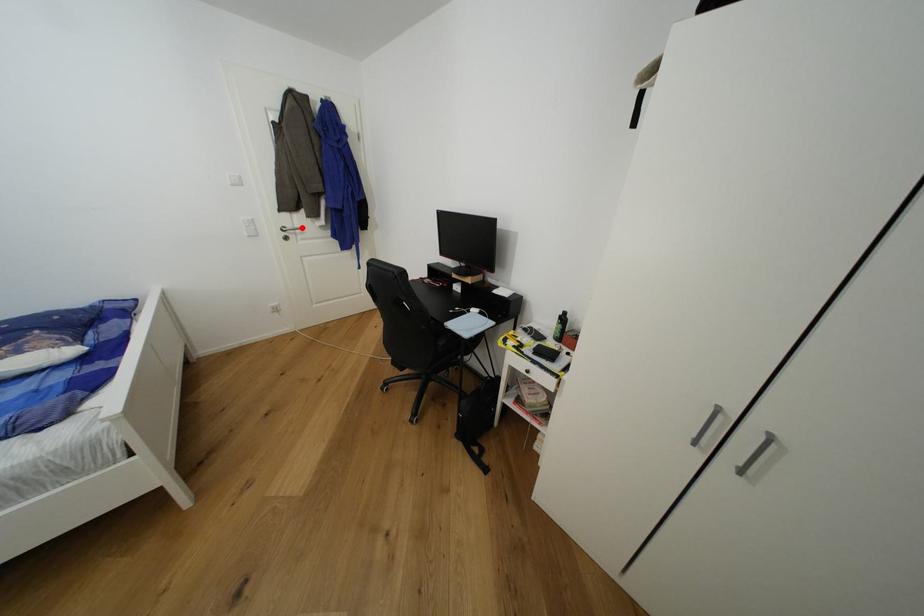
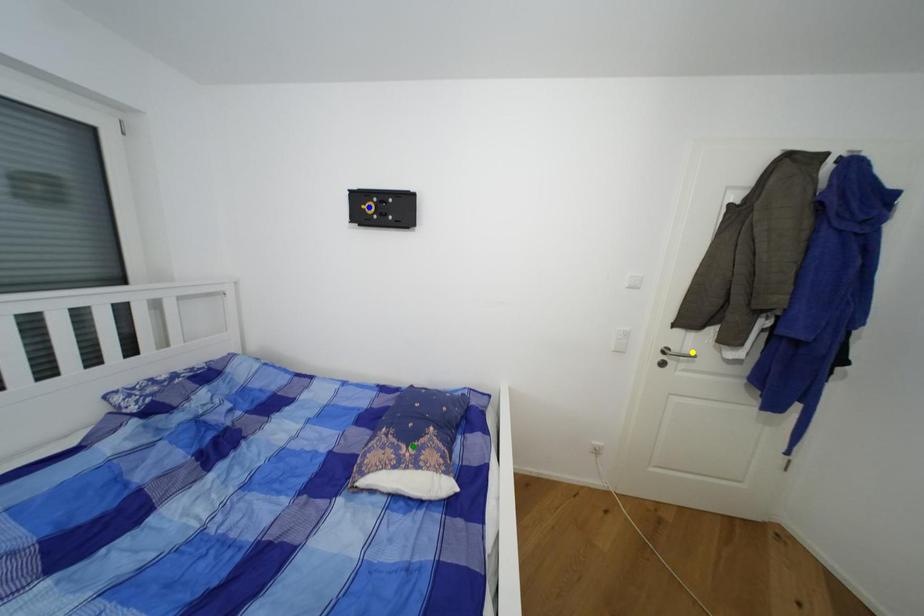
Question: I am providing you with two images of the same scene from different viewpoints. A red point is marked on the first image. You are given multiple points on the second image. Which spot in image 2 lines up with the point in image 1?

Choices:
 (A) blue point
 (B) green point
 (C) yellow point

Answer: (C)